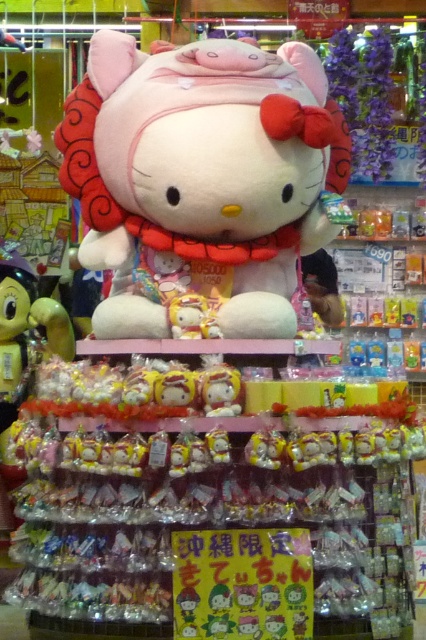
Based on the photo, does fluffy pink plush at center have a greater width compared to matte yellow plush toy at center?

Yes, fluffy pink plush at center is wider than matte yellow plush toy at center.

Can you confirm if fluffy pink plush at center is bigger than matte yellow plush toy at center?

Indeed, fluffy pink plush at center has a larger size compared to matte yellow plush toy at center.

Which is in front, point (307, 186) or point (236, 388)?

Point (236, 388) is more forward.

Locate an element on the screen. The image size is (426, 640). fluffy pink plush at center is located at coordinates (199, 179).